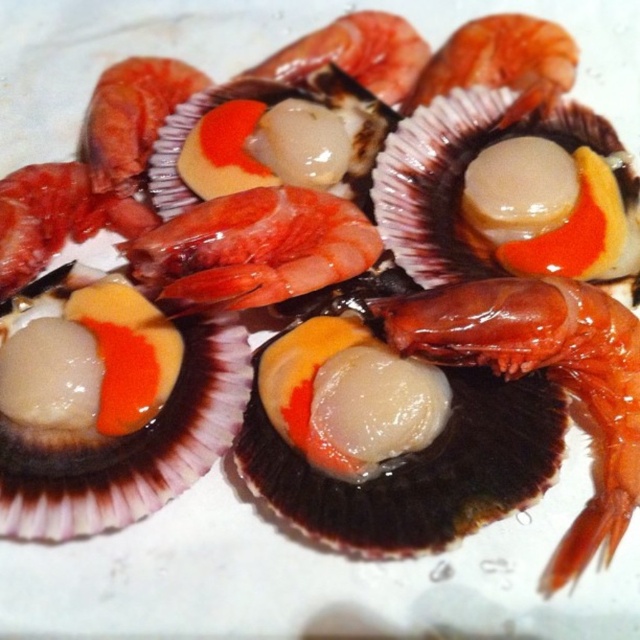
Is translucent gelatinous shrimp at upper center further to camera compared to translucent gelatinous shrimp at center?

No, translucent gelatinous shrimp at upper center is in front of translucent gelatinous shrimp at center.

How distant is translucent gelatinous shrimp at upper center from translucent gelatinous shrimp at center?

translucent gelatinous shrimp at upper center and translucent gelatinous shrimp at center are 10.12 inches apart.

Between point (148, 64) and point (403, 92), which one is positioned behind?

The point (403, 92) is behind.

Where is `translucent gelatinous shrimp at upper center`? translucent gelatinous shrimp at upper center is located at coordinates (131, 118).

Is translucent glossy shrimp at center behind translucent gelatinous shrimp at center?

No, translucent glossy shrimp at center is closer to the viewer.

Does translucent glossy shrimp at center appear under translucent gelatinous shrimp at center?

Correct, translucent glossy shrimp at center is located below translucent gelatinous shrimp at center.

The width and height of the screenshot is (640, 640). What are the coordinates of `translucent glossy shrimp at center` in the screenshot? It's located at (253, 248).

At what (x,y) coordinates should I click in order to perform the action: click on translucent glossy shrimp at center. Please return your answer as a coordinate pair (x, y). Looking at the image, I should click on (253, 248).

Is translucent gelatinous shrimp at upper left to the left of translucent glossy shrimp at upper center from the viewer's perspective?

Indeed, translucent gelatinous shrimp at upper left is positioned on the left side of translucent glossy shrimp at upper center.

Is translucent gelatinous shrimp at upper left below translucent glossy shrimp at upper center?

Indeed, translucent gelatinous shrimp at upper left is positioned under translucent glossy shrimp at upper center.

Is point (13, 224) positioned behind point (531, 26)?

That is False.

Find the location of `translucent gelatinous shrimp at upper left`. translucent gelatinous shrimp at upper left is located at coordinates (56, 218).